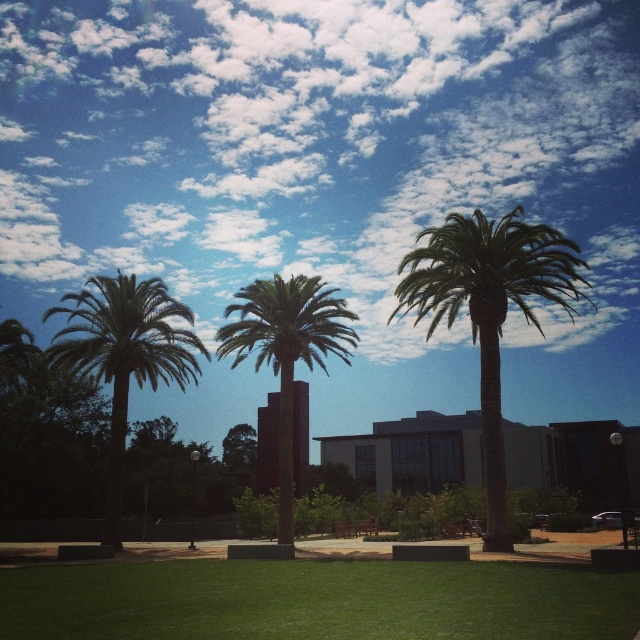
Is point (125, 397) less distant than point (264, 305)?

No, (125, 397) is behind (264, 305).

Does green leafy palm tree at left have a larger size compared to green leafy palm tree at center?

Actually, green leafy palm tree at left might be smaller than green leafy palm tree at center.

The width and height of the screenshot is (640, 640). Describe the element at coordinates (124, 355) in the screenshot. I see `green leafy palm tree at left` at that location.

Where is `green leafy palm tree at left`? green leafy palm tree at left is located at coordinates (124, 355).

Can you confirm if white fluffy cloud at upper center is bigger than green leafy palm at center?

Yes, white fluffy cloud at upper center is bigger than green leafy palm at center.

Which is above, white fluffy cloud at upper center or green leafy palm at center?

white fluffy cloud at upper center is higher up.

What do you see at coordinates (310, 141) in the screenshot? The width and height of the screenshot is (640, 640). I see `white fluffy cloud at upper center` at bounding box center [310, 141].

At what (x,y) coordinates should I click in order to perform the action: click on white fluffy cloud at upper center. Please return your answer as a coordinate pair (x, y). Looking at the image, I should click on (310, 141).

Is white fluffy cloud at upper center taller than green leafy palm tree at left?

Yes.

Image resolution: width=640 pixels, height=640 pixels. I want to click on white fluffy cloud at upper center, so click(310, 141).